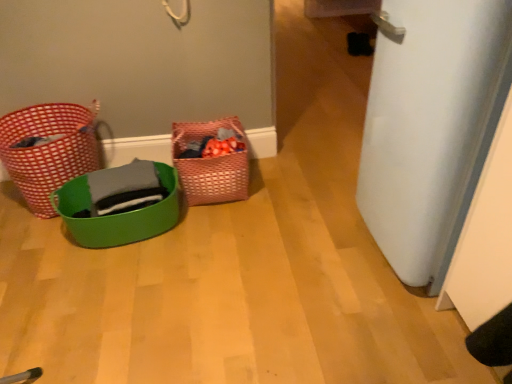
Image resolution: width=512 pixels, height=384 pixels. What are the coordinates of `white matte door at right` in the screenshot? It's located at (430, 126).

Measure the distance between white matte door at right and camera.

1.02 meters.

You are a GUI agent. You are given a task and a screenshot of the screen. Output one action in this format:
    pyautogui.click(x=<x>, y=<y>)
    Task: Click on the woven pink basket at center, arranged as the 1th basket when viewed from the right
    This screenshot has height=384, width=512.
    Given the screenshot: What is the action you would take?
    pyautogui.click(x=210, y=164)

The image size is (512, 384). What are the coordinates of `white matte door at right` in the screenshot? It's located at (430, 126).

Is white matte door at right facing towards woven pink basket at center, arranged as the 1th basket when viewed from the right?

No, white matte door at right is not aimed at woven pink basket at center, arranged as the 1th basket when viewed from the right.

Is white matte door at right in front of or behind woven pink basket at center, arranged as the 1th basket when viewed from the right, in the image?

white matte door at right is in front of woven pink basket at center, arranged as the 1th basket when viewed from the right.

From a real-world perspective, does white matte door at right sit lower than woven pink basket at center, arranged as the 1th basket when viewed from the right?

No.

From the image's perspective, which is below, white matte door at right or woven pink basket at center, marked as the third basket in a left-to-right arrangement?

From the image's view, woven pink basket at center, marked as the third basket in a left-to-right arrangement, is below.

Where is `door above the red woven basket at left, the third basket when ordered from right to left (from a real-world perspective)`? This screenshot has height=384, width=512. door above the red woven basket at left, the third basket when ordered from right to left (from a real-world perspective) is located at coordinates (430, 126).

Is point (69, 140) positioned before point (433, 63)?

No, it is behind (433, 63).

Is red woven basket at left, the third basket when ordered from right to left, oriented away from white matte door at right?

red woven basket at left, the third basket when ordered from right to left, does not have its back to white matte door at right.

Is red woven basket at left, the third basket when ordered from right to left, taller or shorter than white matte door at right?

Considering their sizes, red woven basket at left, the third basket when ordered from right to left, has less height than white matte door at right.

I want to click on door located above the green plastic basket at lower left, the second basket when ordered from left to right (from a real-world perspective), so click(x=430, y=126).

Which of these two, white matte door at right or green plastic basket at lower left, marked as the second basket in a right-to-left arrangement, stands taller?

With more height is white matte door at right.

Based on the photo, which object is further away from the camera, white matte door at right or green plastic basket at lower left, marked as the second basket in a right-to-left arrangement?

green plastic basket at lower left, marked as the second basket in a right-to-left arrangement.

Is point (476, 85) more distant than point (85, 180)?

No, (476, 85) is in front of (85, 180).

From the image's perspective, is white matte door at right above red woven basket at left, the 1th basket in the left-to-right sequence?

Correct, white matte door at right appears higher than red woven basket at left, the 1th basket in the left-to-right sequence, in the image.

Is red woven basket at left, the third basket when ordered from right to left, a part of white matte door at right?

No.

Does white matte door at right have a lesser width compared to red woven basket at left, the third basket when ordered from right to left?

Incorrect, the width of white matte door at right is not less than that of red woven basket at left, the third basket when ordered from right to left.

Can you confirm if white matte door at right is bigger than red woven basket at left, the third basket when ordered from right to left?

Yes.

Which is behind, point (237, 191) or point (452, 251)?

The point (237, 191) is farther from the camera.

Is woven pink basket at center, arranged as the 1th basket when viewed from the right, shorter than white matte door at right?

Yes, woven pink basket at center, arranged as the 1th basket when viewed from the right, is shorter than white matte door at right.

From a real-world perspective, is woven pink basket at center, marked as the third basket in a left-to-right arrangement, below white matte door at right?

Yes, from a real-world perspective, woven pink basket at center, marked as the third basket in a left-to-right arrangement, is beneath white matte door at right.

Does woven pink basket at center, marked as the third basket in a left-to-right arrangement, appear on the left side of white matte door at right?

Correct, you'll find woven pink basket at center, marked as the third basket in a left-to-right arrangement, to the left of white matte door at right.

Measure the distance between red woven basket at left, the 1th basket in the left-to-right sequence, and woven pink basket at center, marked as the third basket in a left-to-right arrangement.

red woven basket at left, the 1th basket in the left-to-right sequence, is 24.56 inches away from woven pink basket at center, marked as the third basket in a left-to-right arrangement.

What's the angular difference between red woven basket at left, the 1th basket in the left-to-right sequence, and woven pink basket at center, arranged as the 1th basket when viewed from the right,'s facing directions?

There is a 1.84-degree angle between the facing directions of red woven basket at left, the 1th basket in the left-to-right sequence, and woven pink basket at center, arranged as the 1th basket when viewed from the right.

Considering the relative positions of red woven basket at left, the 1th basket in the left-to-right sequence, and woven pink basket at center, marked as the third basket in a left-to-right arrangement, in the image provided, is red woven basket at left, the 1th basket in the left-to-right sequence, to the left of woven pink basket at center, marked as the third basket in a left-to-right arrangement, from the viewer's perspective?

Yes.

Is point (63, 131) closer to camera compared to point (215, 171)?

Yes.

Are woven pink basket at center, marked as the third basket in a left-to-right arrangement, and red woven basket at left, the 1th basket in the left-to-right sequence, far apart?

No, woven pink basket at center, marked as the third basket in a left-to-right arrangement, is in close proximity to red woven basket at left, the 1th basket in the left-to-right sequence.

Does woven pink basket at center, arranged as the 1th basket when viewed from the right, have a lesser height compared to red woven basket at left, the 1th basket in the left-to-right sequence?

Yes, woven pink basket at center, arranged as the 1th basket when viewed from the right, is shorter than red woven basket at left, the 1th basket in the left-to-right sequence.

Could you tell me if woven pink basket at center, arranged as the 1th basket when viewed from the right, is facing red woven basket at left, the third basket when ordered from right to left?

No, woven pink basket at center, arranged as the 1th basket when viewed from the right, is not facing towards red woven basket at left, the third basket when ordered from right to left.

Is woven pink basket at center, marked as the third basket in a left-to-right arrangement, situated inside red woven basket at left, the 1th basket in the left-to-right sequence, or outside?

woven pink basket at center, marked as the third basket in a left-to-right arrangement, lies outside red woven basket at left, the 1th basket in the left-to-right sequence.

Where is `basket that is the 1st one when counting leftward from the white matte door at right`? basket that is the 1st one when counting leftward from the white matte door at right is located at coordinates (210, 164).

The width and height of the screenshot is (512, 384). I want to click on the 2nd basket behind the white matte door at right, starting your count from the anchor, so click(48, 149).

Based on their spatial positions, is red woven basket at left, the third basket when ordered from right to left, or woven pink basket at center, arranged as the 1th basket when viewed from the right, further from white matte door at right?

The object further to white matte door at right is red woven basket at left, the third basket when ordered from right to left.

Which object lies further to the anchor point green plastic basket at lower left, marked as the second basket in a right-to-left arrangement, red woven basket at left, the third basket when ordered from right to left, or woven pink basket at center, marked as the third basket in a left-to-right arrangement?

The object further to green plastic basket at lower left, marked as the second basket in a right-to-left arrangement, is red woven basket at left, the third basket when ordered from right to left.

Which object lies further to the anchor point woven pink basket at center, arranged as the 1th basket when viewed from the right, white matte door at right or red woven basket at left, the third basket when ordered from right to left?

white matte door at right is positioned further to the anchor woven pink basket at center, arranged as the 1th basket when viewed from the right.

From the image, which object appears to be farther from red woven basket at left, the 1th basket in the left-to-right sequence, green plastic basket at lower left, the second basket when ordered from left to right, or woven pink basket at center, arranged as the 1th basket when viewed from the right?

woven pink basket at center, arranged as the 1th basket when viewed from the right.

In the scene shown: Based on their spatial positions, is red woven basket at left, the 1th basket in the left-to-right sequence, or green plastic basket at lower left, the second basket when ordered from left to right, closer to white matte door at right?

Based on the image, green plastic basket at lower left, the second basket when ordered from left to right, appears to be nearer to white matte door at right.

From the image, which object appears to be nearer to woven pink basket at center, marked as the third basket in a left-to-right arrangement, green plastic basket at lower left, the second basket when ordered from left to right, or white matte door at right?

The object closer to woven pink basket at center, marked as the third basket in a left-to-right arrangement, is green plastic basket at lower left, the second basket when ordered from left to right.

Based on their spatial positions, is green plastic basket at lower left, the second basket when ordered from left to right, or woven pink basket at center, arranged as the 1th basket when viewed from the right, closer to white matte door at right?

woven pink basket at center, arranged as the 1th basket when viewed from the right, is closer to white matte door at right.

Looking at the image, which one is located further to red woven basket at left, the 1th basket in the left-to-right sequence, green plastic basket at lower left, the second basket when ordered from left to right, or white matte door at right?

white matte door at right is positioned further to the anchor red woven basket at left, the 1th basket in the left-to-right sequence.

Locate an element on the screen. basket between red woven basket at left, the 1th basket in the left-to-right sequence, and woven pink basket at center, arranged as the 1th basket when viewed from the right, in the horizontal direction is located at coordinates (116, 215).

Where is `basket between green plastic basket at lower left, the second basket when ordered from left to right, and white matte door at right`? basket between green plastic basket at lower left, the second basket when ordered from left to right, and white matte door at right is located at coordinates (210, 164).